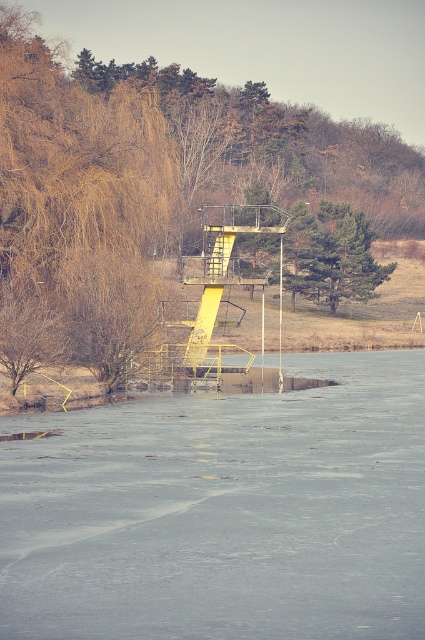
You are standing at the diving platform and looking towards the frozen lake. There are two points marked on the ice surface. The first point is at coordinates point (53, 548) and the second point is at point (323, 200). Which point is closer to you?

Point (53, 548) is in front of point (323, 200), so it is closer to you.